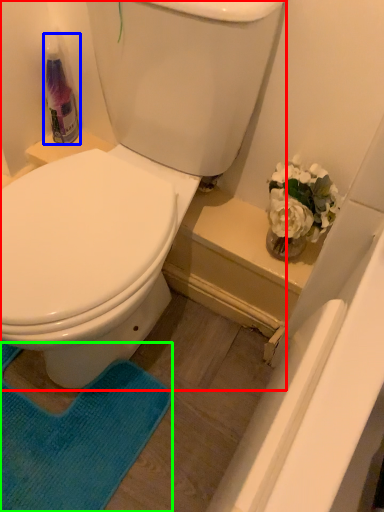
Question: Considering the real-world distances, which object is closest to toilet (highlighted by a red box)? cleaning product (highlighted by a blue box) or yoga mat (highlighted by a green box).

Choices:
 (A) cleaning product
 (B) yoga mat

Answer: (A)